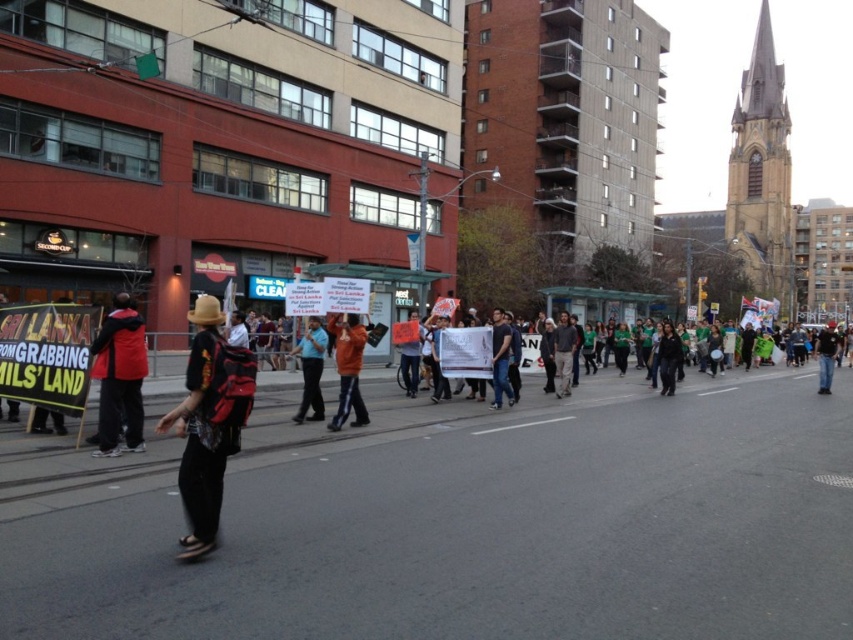
Question: Estimate the real-world distances between objects in this image. Which object is farther from the matte red jacket at left?

Choices:
 (A) orange fabric sign at center
 (B) matte black backpack at center
 (C) black fabric shirt at right
 (D) dark blue jeans at center

Answer: (C)

Question: Is orange fabric sign at center bigger than black fabric shirt at right?

Choices:
 (A) yes
 (B) no

Answer: (B)

Question: Which of the following is the closest to the observer?

Choices:
 (A) matte red jacket at left
 (B) orange fabric jacket at center
 (C) blue shirt at center
 (D) black fabric shirt at right

Answer: (A)

Question: Which of the following is the farthest from the observer?

Choices:
 (A) orange fabric jacket at center
 (B) blue shirt at center
 (C) matte black backpack at center

Answer: (B)

Question: Does dark blue jeans at center come behind orange fabric sign at center?

Choices:
 (A) no
 (B) yes

Answer: (A)

Question: Can you confirm if matte black backpack at center is positioned to the right of black fabric shirt at right?

Choices:
 (A) no
 (B) yes

Answer: (A)